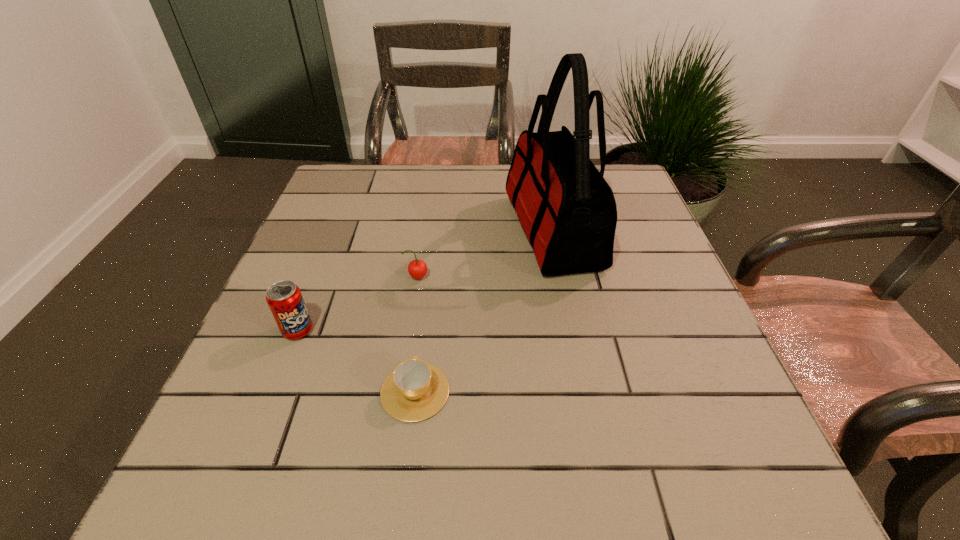
You are a GUI agent. You are given a task and a screenshot of the screen. Output one action in this format:
    pyautogui.click(x=<x>, y=<y>)
    Task: Click on the vacant space located with the handle on the side of the cup
    The height and width of the screenshot is (540, 960).
    Given the screenshot: What is the action you would take?
    pyautogui.click(x=434, y=240)

Locate an element on the screen. free space located 0.310m with the handle on the side of the cup is located at coordinates (432, 255).

Find the location of a particular element. This screenshot has width=960, height=540. free space located with the handle on the side of the cup is located at coordinates click(432, 255).

Where is `object located in the far edge section of the desktop`? The image size is (960, 540). object located in the far edge section of the desktop is located at coordinates (567, 210).

This screenshot has height=540, width=960. In order to click on object at the left edge in this screenshot , I will do `click(284, 298)`.

What are the coordinates of `object that is at the right edge` in the screenshot? It's located at (567, 210).

Where is `object situated at the far right corner`? object situated at the far right corner is located at coordinates (567, 210).

The width and height of the screenshot is (960, 540). Find the location of `free space at the far edge of the desktop`. free space at the far edge of the desktop is located at coordinates (386, 187).

I want to click on vacant space at the near edge of the desktop, so click(x=424, y=457).

Where is `free point at the left edge`? This screenshot has height=540, width=960. free point at the left edge is located at coordinates (300, 399).